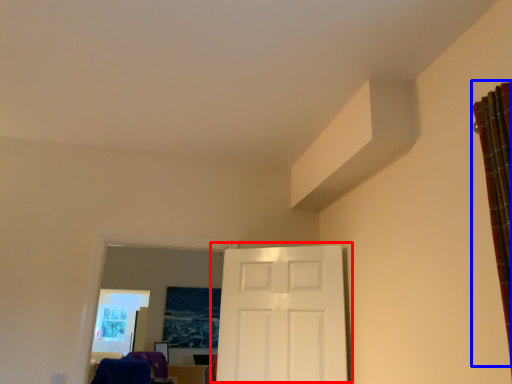
Question: Among these objects, which one is nearest to the camera, door (highlighted by a red box) or curtain (highlighted by a blue box)?

Choices:
 (A) door
 (B) curtain

Answer: (B)